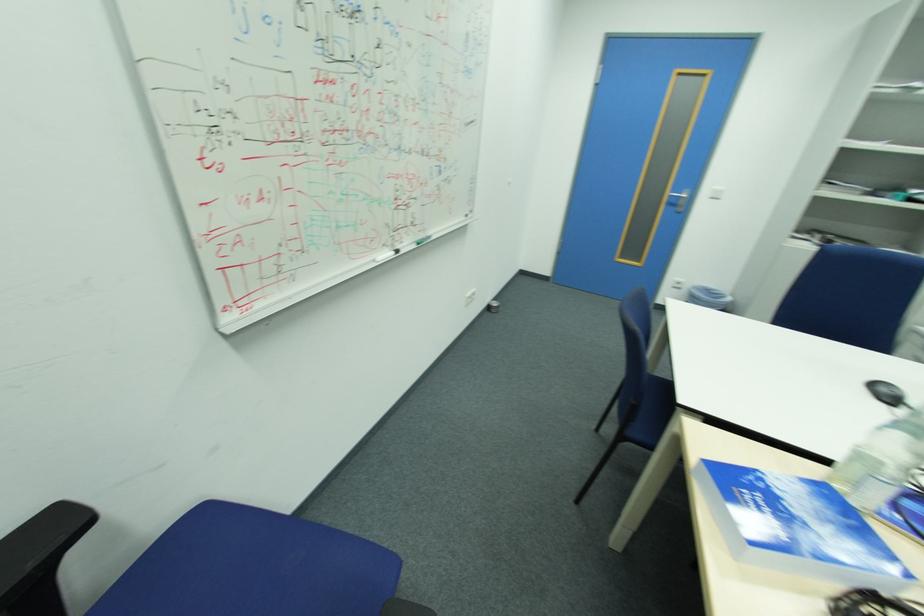
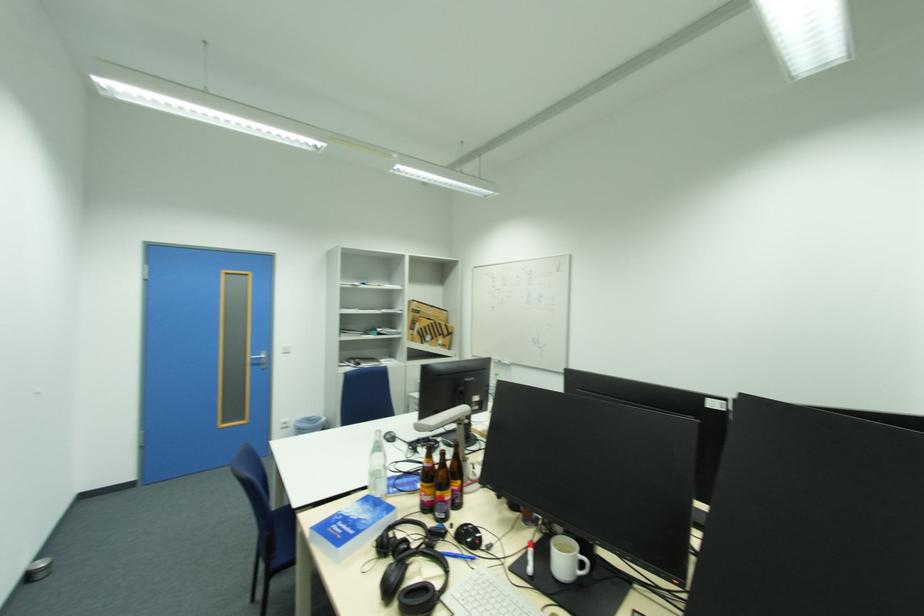
Where in the second image is the point corresponding to (796,512) from the first image?

(360, 517)